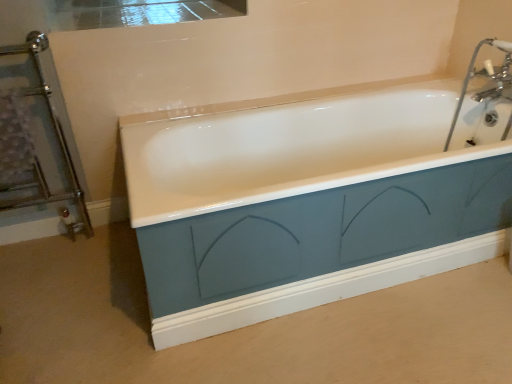
Question: Considering the positions of point (505, 127) and point (26, 49), is point (505, 127) closer or farther from the camera than point (26, 49)?

Choices:
 (A) closer
 (B) farther

Answer: (B)

Question: From the image's perspective, relative to chrome metallic towel rack at left, is chrome metallic faucet at upper right above or below?

Choices:
 (A) below
 (B) above

Answer: (B)

Question: Looking at their shapes, would you say chrome metallic faucet at upper right is wider or thinner than chrome metallic towel rack at left?

Choices:
 (A) thin
 (B) wide

Answer: (B)

Question: Considering the positions of point (x=46, y=195) and point (x=471, y=74), is point (x=46, y=195) closer or farther from the camera than point (x=471, y=74)?

Choices:
 (A) closer
 (B) farther

Answer: (A)

Question: Considering the relative positions of chrome metallic towel rack at left and chrome metallic faucet at upper right in the image provided, is chrome metallic towel rack at left to the left or to the right of chrome metallic faucet at upper right?

Choices:
 (A) right
 (B) left

Answer: (B)

Question: Would you say chrome metallic towel rack at left is inside or outside chrome metallic faucet at upper right?

Choices:
 (A) outside
 (B) inside

Answer: (A)

Question: From a real-world perspective, is chrome metallic towel rack at left physically located above or below chrome metallic faucet at upper right?

Choices:
 (A) above
 (B) below

Answer: (B)